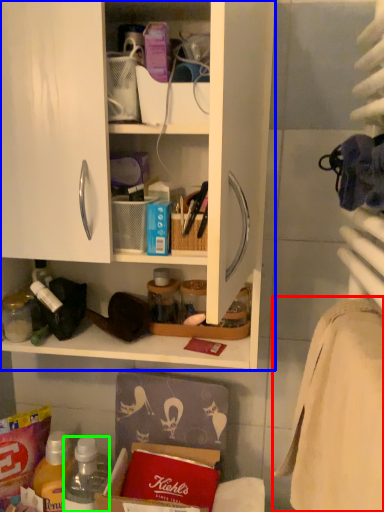
Question: Based on their relative distances, which object is farther from bath towel (highlighted by a red box)? Choose from cabinetry (highlighted by a blue box) and bottle (highlighted by a green box).

Choices:
 (A) cabinetry
 (B) bottle

Answer: (B)